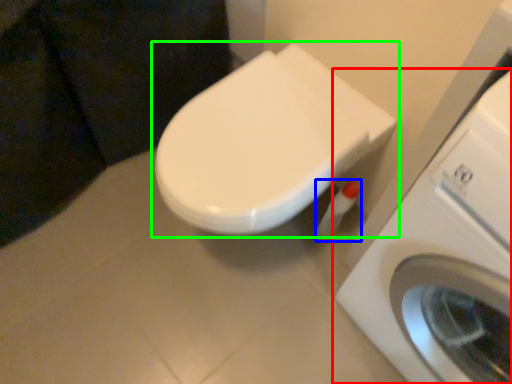
Question: Which object is the closest to the washing machine (highlighted by a red box)? Choose among these: toilet paper (highlighted by a blue box) or toilet (highlighted by a green box).

Choices:
 (A) toilet paper
 (B) toilet

Answer: (B)